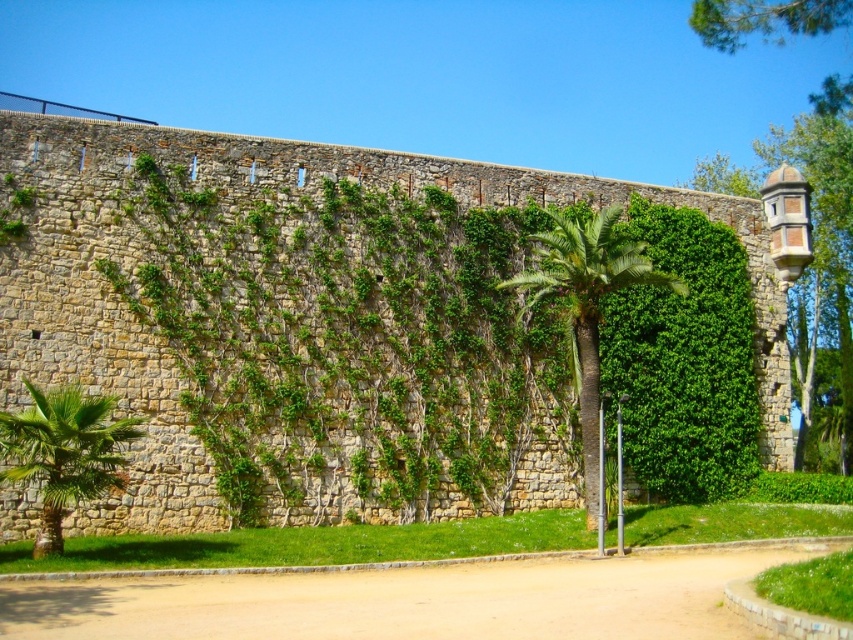
Question: Can you confirm if green leafy palm tree at lower left is thinner than metallic pole at lower center?

Choices:
 (A) no
 (B) yes

Answer: (B)

Question: Does brown dirt path at center have a lesser width compared to green leafy palm tree at lower left?

Choices:
 (A) no
 (B) yes

Answer: (A)

Question: Which object appears farthest from the camera in this image?

Choices:
 (A) brown dirt path at center
 (B) metallic pole at lower center
 (C) green leafy hedge at center

Answer: (C)

Question: Considering the real-world distances, which object is farthest from the green leafy hedge at center?

Choices:
 (A) brown dirt path at center
 (B) metallic pole at lower center
 (C) green leafy palm tree at lower left
 (D) green leafy palm at center

Answer: (C)

Question: Based on their relative distances, which object is nearer to the green leafy hedge at center?

Choices:
 (A) green leafy palm tree at lower left
 (B) metallic pole at lower center

Answer: (B)

Question: Can you confirm if brown dirt path at center is thinner than green leafy palm tree at lower left?

Choices:
 (A) yes
 (B) no

Answer: (B)